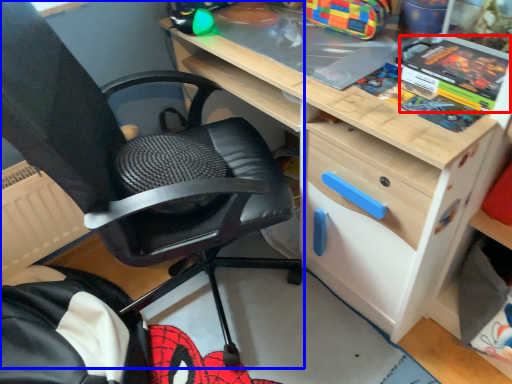
Question: Which object is closer to the camera taking this photo, comic book (highlighted by a red box) or chair (highlighted by a blue box)?

Choices:
 (A) comic book
 (B) chair

Answer: (B)